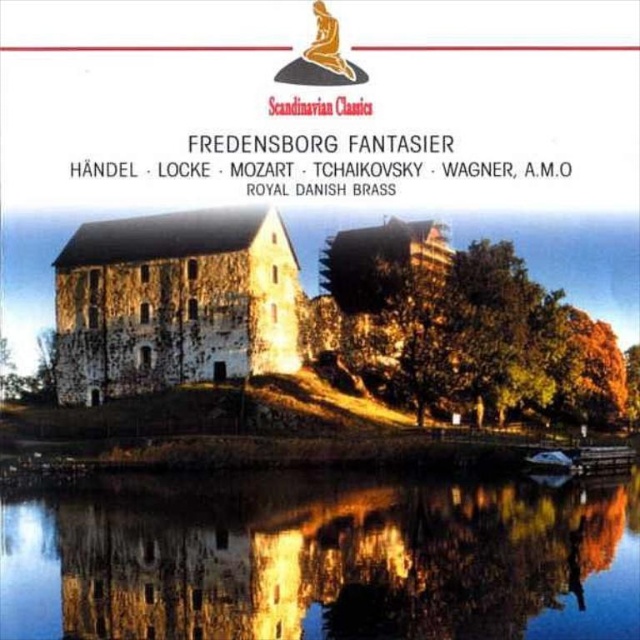
Based on the scene described, which object, the transparent glass water at lower center or the stone textured castle at center, has a greater height in the image?

The stone textured castle at center is taller than the transparent glass water at lower center according to the description provided.

You are standing at the point labeled as point (x=324, y=561) in the image. What is the material of the surface you are currently standing on?

The surface at point (x=324, y=561) is transparent glass water at lower center, so you are standing on transparent glass water at lower center.

You are an album cover designer who wants to add a small boat to the image. The boat is 1 meter wide. Where should you place it so that it fits entirely within the transparent glass water at lower center without overlapping the stone textured castle at center?

The transparent glass water at lower center has a larger width than the stone textured castle at center. Therefore, the boat should be placed within the transparent glass water at lower center, ensuring it stays away from the castle to avoid overlapping.